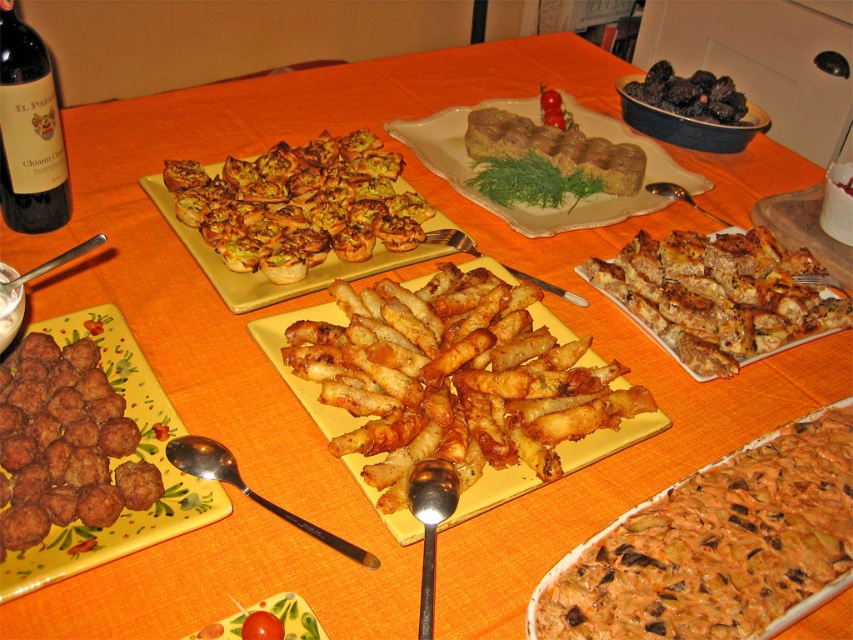
Does golden crispy pastry at center appear on the left side of brown crumbly meatballs at lower left?

No, golden crispy pastry at center is not to the left of brown crumbly meatballs at lower left.

Which of these two, golden crispy pastry at center or brown crumbly meatballs at lower left, stands taller?

Standing taller between the two is golden crispy pastry at center.

Who is more forward, (259, 236) or (97, 461)?

Point (97, 461) is more forward.

The height and width of the screenshot is (640, 853). Identify the location of golden crispy pastry at center. pyautogui.click(x=299, y=205).

Is point (699, 476) farther from camera compared to point (556, 362)?

No, (699, 476) is in front of (556, 362).

Does smooth creamy pasta at center appear on the left side of golden crispy fries at center?

In fact, smooth creamy pasta at center is to the right of golden crispy fries at center.

The image size is (853, 640). In order to click on smooth creamy pasta at center in this screenshot , I will do `click(718, 545)`.

Identify the location of smooth creamy pasta at center. (718, 545).

Can you confirm if dark red glass bottle at upper left is wider than brown crumbly pastry at center?

Answer: No, dark red glass bottle at upper left is not wider than brown crumbly pastry at center.

Can you confirm if dark red glass bottle at upper left is positioned to the left of brown crumbly pastry at center?

Yes, dark red glass bottle at upper left is to the left of brown crumbly pastry at center.

Is point (0, 48) more distant than point (618, 170)?

No, (0, 48) is closer to viewer.

In order to click on dark red glass bottle at upper left in this screenshot , I will do `click(28, 131)`.